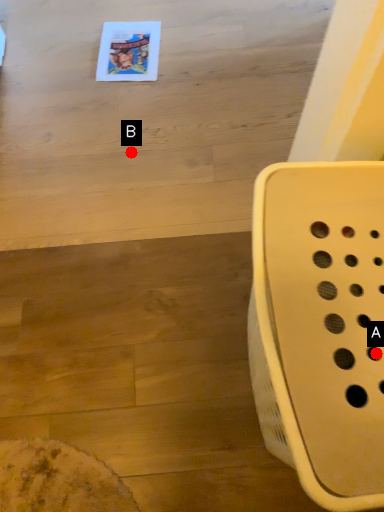
Question: Two points are circled on the image, labeled by A and B beside each circle. Among these points, which one is farthest from the camera?

Choices:
 (A) A is further
 (B) B is further

Answer: (B)